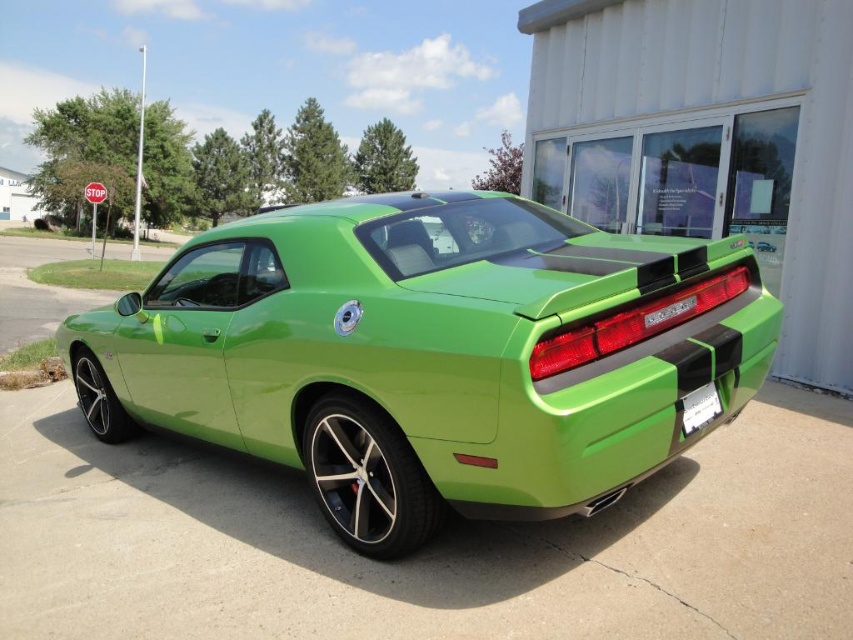
Does lime green matte car at center have a lesser height compared to white plastic license plate at lower right?

In fact, lime green matte car at center may be taller than white plastic license plate at lower right.

Is point (252, 372) positioned after point (708, 422)?

Yes.

Between point (96, 352) and point (705, 412), which one is positioned in front?

Point (705, 412) is in front.

What are the coordinates of `lime green matte car at center` in the screenshot? It's located at (430, 353).